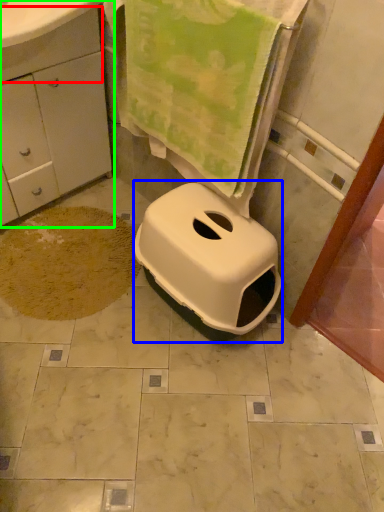
Question: Which object is the farthest from drawer (highlighted by a red box)? Choose among these: bidet (highlighted by a blue box) or bathroom cabinet (highlighted by a green box).

Choices:
 (A) bidet
 (B) bathroom cabinet

Answer: (A)